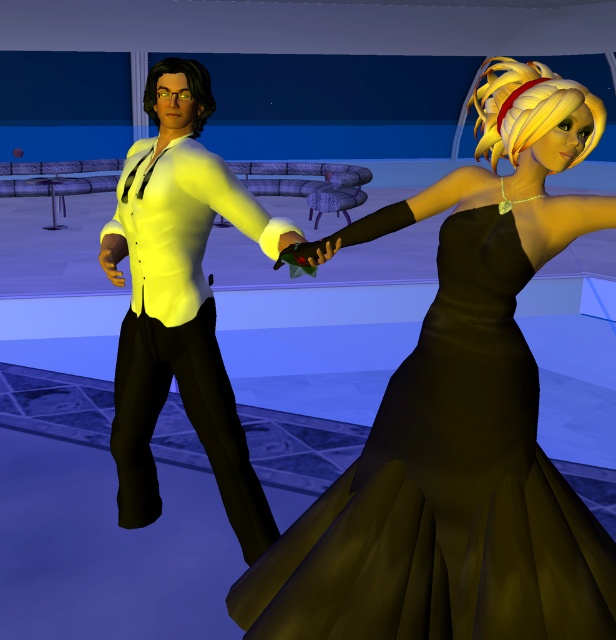
You are a photographer trying to capture both the black satin dress at center and the matte yellow shirt at center in a single frame. Which of the two should you focus on first to ensure they are both in focus?

The black satin dress at center is smaller than the matte yellow shirt at center, so you should focus on the matte yellow shirt at center first to ensure both are in focus.

You are an animator working on a dance scene. You need to position a spotlight at the exact center of the image. The spotlight has a radius of 0.1 units. Will the spotlight cover the black satin dress at center?

The 2D location of black satin dress at center is at point (445, 490). The exact center of the image is at point (308, 320). The distance between the dress and the center is sqrt of squared differences between coordinates, which is sqrt of 0.266 squared plus 0.224 squared. Calculating that gives sqrt of 0.070756 plus 0.050176 equals sqrt of 0.120932, which is approximately 0.348 units. Since the spotlight has a radius of 0.1 units, the distance of 0.348 is greater than 0.1, so the spotlight will not cover.